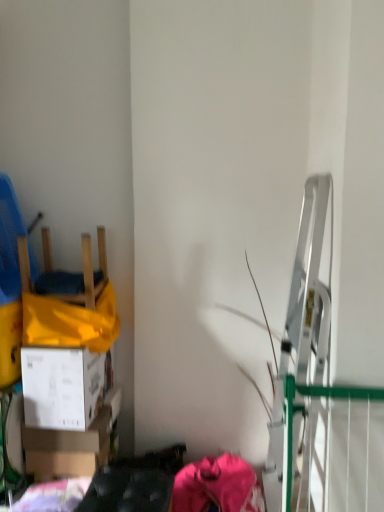
Question: Can you confirm if white cardboard box at lower left, which is the first box in bottom-to-top order, is wider than white cardboard box at lower left, placed as the second box when sorted from bottom to top?

Choices:
 (A) no
 (B) yes

Answer: (A)

Question: Is white cardboard box at lower left, which is the first box in bottom-to-top order, at the left side of white cardboard box at lower left, which appears as the 1th box when viewed from the top?

Choices:
 (A) yes
 (B) no

Answer: (B)

Question: Is white cardboard box at lower left, arranged as the second box when viewed from the top, far from white cardboard box at lower left, which appears as the 1th box when viewed from the top?

Choices:
 (A) no
 (B) yes

Answer: (A)

Question: From the image's perspective, is white cardboard box at lower left, which is the first box in bottom-to-top order, above white cardboard box at lower left, which appears as the 1th box when viewed from the top?

Choices:
 (A) yes
 (B) no

Answer: (B)

Question: Is white cardboard box at lower left, arranged as the second box when viewed from the top, bigger than white cardboard box at lower left, which appears as the 1th box when viewed from the top?

Choices:
 (A) yes
 (B) no

Answer: (B)

Question: From their relative heights in the image, would you say wooden chair at left is taller or shorter than white cardboard box at lower left, placed as the second box when sorted from bottom to top?

Choices:
 (A) tall
 (B) short

Answer: (B)

Question: From the image's perspective, is wooden chair at left positioned above or below white cardboard box at lower left, placed as the second box when sorted from bottom to top?

Choices:
 (A) below
 (B) above

Answer: (B)

Question: Does point (13, 284) appear closer or farther from the camera than point (79, 370)?

Choices:
 (A) farther
 (B) closer

Answer: (A)

Question: Looking at the image, does wooden chair at left seem bigger or smaller compared to white cardboard box at lower left, which appears as the 1th box when viewed from the top?

Choices:
 (A) small
 (B) big

Answer: (B)

Question: From their relative heights in the image, would you say white cardboard box at lower left, which appears as the 1th box when viewed from the top, is taller or shorter than white cardboard box at lower left, which is the first box in bottom-to-top order?

Choices:
 (A) short
 (B) tall

Answer: (B)

Question: Is white cardboard box at lower left, placed as the second box when sorted from bottom to top, spatially inside white cardboard box at lower left, arranged as the second box when viewed from the top, or outside of it?

Choices:
 (A) outside
 (B) inside

Answer: (A)

Question: Relative to white cardboard box at lower left, arranged as the second box when viewed from the top, is white cardboard box at lower left, which appears as the 1th box when viewed from the top, in front or behind?

Choices:
 (A) behind
 (B) front

Answer: (B)

Question: In the image, is white cardboard box at lower left, placed as the second box when sorted from bottom to top, on the left side or the right side of white cardboard box at lower left, which is the first box in bottom-to-top order?

Choices:
 (A) left
 (B) right

Answer: (A)

Question: Considering the positions of white cardboard box at lower left, which appears as the 1th box when viewed from the top, and wooden chair at left in the image, is white cardboard box at lower left, which appears as the 1th box when viewed from the top, bigger or smaller than wooden chair at left?

Choices:
 (A) big
 (B) small

Answer: (B)

Question: Is white cardboard box at lower left, placed as the second box when sorted from bottom to top, wider or thinner than wooden chair at left?

Choices:
 (A) wide
 (B) thin

Answer: (B)